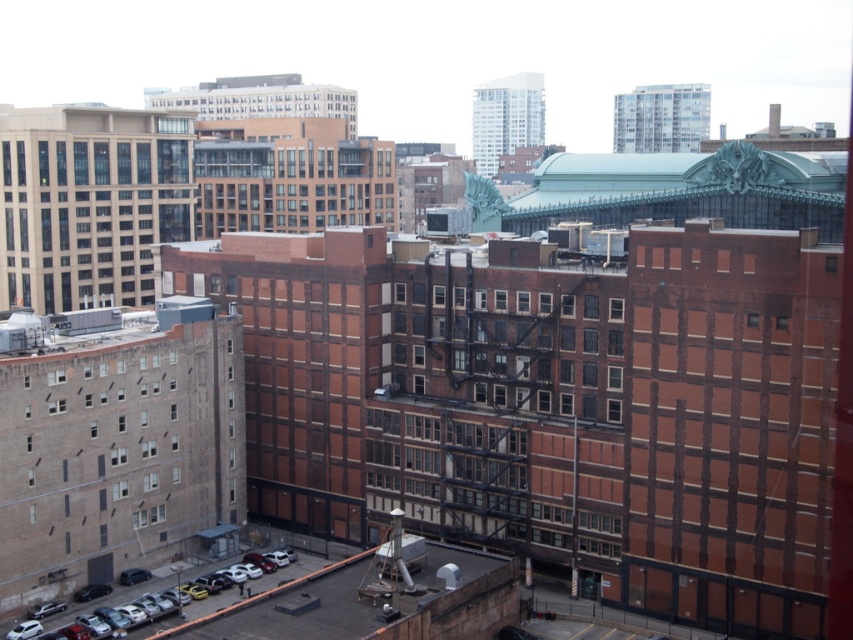
You are a delivery person trying to park your white matte car at lower left near the white glass window at center. Since both are white, how can you distinguish them from each other?

The white matte car at lower left is larger in size than the white glass window at center, so you can tell them apart by their size.

You are a delivery person trying to park your white matte car at lower left near the entrance of the building. However, there is a white glass window at center above the parking spot. Can you park your car there without damaging the window?

The white matte car at lower left is positioned under the white glass window at center, so parking the car there may risk damaging the window if the car is taller than the clearance allowed by the window height.

You are a pedestrian standing at the corner of the street. You see a white matte car at lower left and a white glass window at center. Which object is closer to you?

The white matte car at lower left is closer to you because it is positioned in front of the white glass window at center.